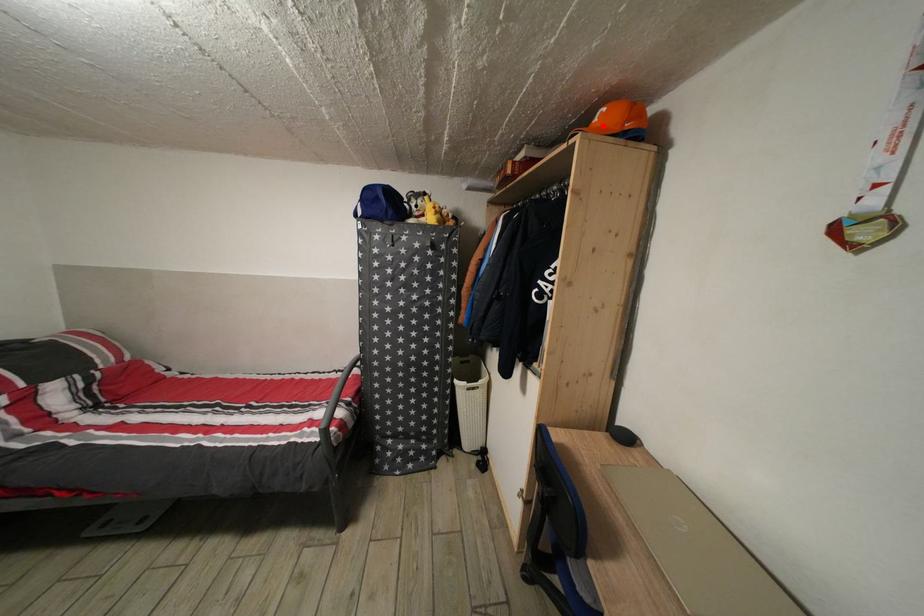
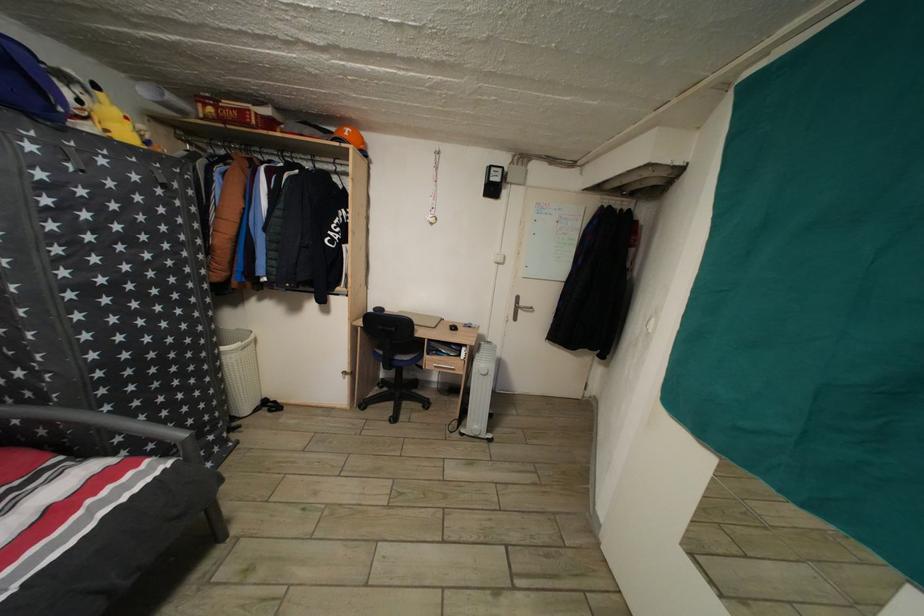
In the second image, find the point that corresponds to the highlighted location in the first image.

(354, 140)